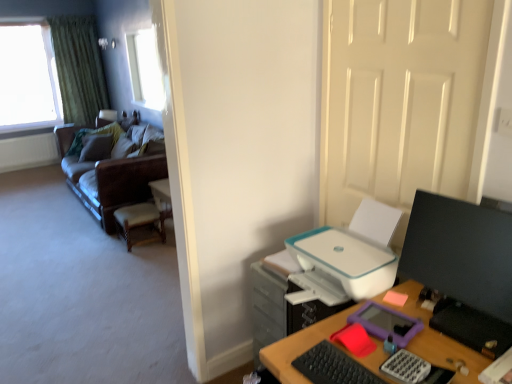
Question: Relative to black matte keyboard at lower right, is brown leather couch at left in front or behind?

Choices:
 (A) front
 (B) behind

Answer: (B)

Question: Would you say brown leather couch at left is to the left or to the right of black matte keyboard at lower right in the picture?

Choices:
 (A) right
 (B) left

Answer: (B)

Question: Which object is positioned farthest from the black glossy monitor at right?

Choices:
 (A) white plastic printer at right
 (B) white plastic file cabinet at lower right
 (C) pink matte sticky notes at right
 (D) black matte keyboard at lower right
 (E) brown leather couch at left

Answer: (E)

Question: Estimate the real-world distances between objects in this image. Which object is farther from the black glossy monitor at right?

Choices:
 (A) clear glass window at upper left, marked as the first window in a front-to-back arrangement
 (B) white glossy door at upper right
 (C) green textured curtain at upper left
 (D) wooden woven seat at left
 (E) black matte keyboard at lower right

Answer: (C)